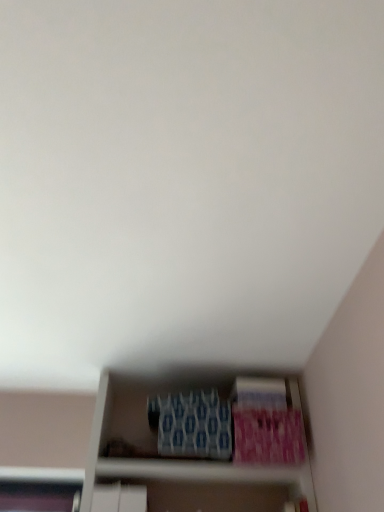
What do you see at coordinates (259, 393) in the screenshot? Image resolution: width=384 pixels, height=512 pixels. I see `blue textured paperback book at lower center, the second paperback book viewed from the left` at bounding box center [259, 393].

How much space does pink matte paperback book at lower right, which appears as the first paperback book when viewed from the right, occupy vertically?

7.54 inches.

This screenshot has width=384, height=512. What do you see at coordinates (268, 436) in the screenshot?
I see `pink matte paperback book at lower right, which is the 3th paperback book in left-to-right order` at bounding box center [268, 436].

You are a GUI agent. You are given a task and a screenshot of the screen. Output one action in this format:
    pyautogui.click(x=<x>, y=<y>)
    Task: Click on the blue textured paperback book at center, the 1th paperback book in the left-to-right sequence
    
    Given the screenshot: What is the action you would take?
    pyautogui.click(x=192, y=424)

Would you consider pink matte paperback book at lower right, which appears as the first paperback book when viewed from the right, to be distant from blue textured paperback book at center, the 3th paperback book in the right-to-left sequence?

No, pink matte paperback book at lower right, which appears as the first paperback book when viewed from the right, is not far away from blue textured paperback book at center, the 3th paperback book in the right-to-left sequence.

Does pink matte paperback book at lower right, which is the 3th paperback book in left-to-right order, come in front of blue textured paperback book at center, the 3th paperback book in the right-to-left sequence?

No, pink matte paperback book at lower right, which is the 3th paperback book in left-to-right order, is further to the viewer.

Which point is more distant from viewer, (303, 438) or (200, 440)?

The point (303, 438) is farther.

Where is `the 1st paperback book above when counting from the pink matte paperback book at lower right, which appears as the first paperback book when viewed from the right (from the image's perspective)`? Image resolution: width=384 pixels, height=512 pixels. the 1st paperback book above when counting from the pink matte paperback book at lower right, which appears as the first paperback book when viewed from the right (from the image's perspective) is located at coordinates (192, 424).

Is blue textured paperback book at center, the 3th paperback book in the right-to-left sequence, next to pink matte paperback book at lower right, which is the 3th paperback book in left-to-right order?

blue textured paperback book at center, the 3th paperback book in the right-to-left sequence, is not next to pink matte paperback book at lower right, which is the 3th paperback book in left-to-right order, and they're not touching.

Which object is thinner, blue textured paperback book at center, the 3th paperback book in the right-to-left sequence, or pink matte paperback book at lower right, which appears as the first paperback book when viewed from the right?

Thinner between the two is pink matte paperback book at lower right, which appears as the first paperback book when viewed from the right.

Does blue textured paperback book at center, the 1th paperback book in the left-to-right sequence, contain pink matte paperback book at lower right, which is the 3th paperback book in left-to-right order?

No, blue textured paperback book at center, the 1th paperback book in the left-to-right sequence, does not contain pink matte paperback book at lower right, which is the 3th paperback book in left-to-right order.

Relative to blue textured paperback book at center, the 1th paperback book in the left-to-right sequence, is blue textured paperback book at lower center, the second paperback book in the right-to-left sequence, in front or behind?

blue textured paperback book at lower center, the second paperback book in the right-to-left sequence, is positioned farther from the viewer than blue textured paperback book at center, the 1th paperback book in the left-to-right sequence.

Based on their sizes in the image, would you say blue textured paperback book at lower center, the second paperback book viewed from the left, is bigger or smaller than blue textured paperback book at center, the 1th paperback book in the left-to-right sequence?

Considering their sizes, blue textured paperback book at lower center, the second paperback book viewed from the left, takes up less space than blue textured paperback book at center, the 1th paperback book in the left-to-right sequence.

Considering the sizes of objects blue textured paperback book at lower center, the second paperback book in the right-to-left sequence, and blue textured paperback book at center, the 3th paperback book in the right-to-left sequence, in the image provided, who is taller, blue textured paperback book at lower center, the second paperback book in the right-to-left sequence, or blue textured paperback book at center, the 3th paperback book in the right-to-left sequence,?

With more height is blue textured paperback book at center, the 3th paperback book in the right-to-left sequence.

Considering the positions of objects blue textured paperback book at center, the 3th paperback book in the right-to-left sequence, and blue textured paperback book at lower center, the second paperback book viewed from the left, in the image provided, who is more to the left, blue textured paperback book at center, the 3th paperback book in the right-to-left sequence, or blue textured paperback book at lower center, the second paperback book viewed from the left,?

From the viewer's perspective, blue textured paperback book at center, the 3th paperback book in the right-to-left sequence, appears more on the left side.

In the scene shown: Is blue textured paperback book at center, the 1th paperback book in the left-to-right sequence, not close to blue textured paperback book at lower center, the second paperback book in the right-to-left sequence?

That's not correct — blue textured paperback book at center, the 1th paperback book in the left-to-right sequence, is a little close to blue textured paperback book at lower center, the second paperback book in the right-to-left sequence.

Is blue textured paperback book at center, the 1th paperback book in the left-to-right sequence, looking in the opposite direction of blue textured paperback book at lower center, the second paperback book in the right-to-left sequence?

No, blue textured paperback book at center, the 1th paperback book in the left-to-right sequence, is not facing the opposite direction of blue textured paperback book at lower center, the second paperback book in the right-to-left sequence.

Considering the positions of objects blue textured paperback book at center, the 3th paperback book in the right-to-left sequence, and blue textured paperback book at lower center, the second paperback book in the right-to-left sequence, in the image provided, who is behind, blue textured paperback book at center, the 3th paperback book in the right-to-left sequence, or blue textured paperback book at lower center, the second paperback book in the right-to-left sequence,?

blue textured paperback book at lower center, the second paperback book in the right-to-left sequence, is further from the camera.

From a real-world perspective, is blue textured paperback book at lower center, the second paperback book in the right-to-left sequence, positioned above or below pink matte paperback book at lower right, which is the 3th paperback book in left-to-right order?

Clearly, from a real-world perspective, blue textured paperback book at lower center, the second paperback book in the right-to-left sequence, is above pink matte paperback book at lower right, which is the 3th paperback book in left-to-right order.

Could you tell me if blue textured paperback book at lower center, the second paperback book in the right-to-left sequence, is facing pink matte paperback book at lower right, which appears as the first paperback book when viewed from the right?

No.

Considering the sizes of objects blue textured paperback book at lower center, the second paperback book viewed from the left, and pink matte paperback book at lower right, which appears as the first paperback book when viewed from the right, in the image provided, who is shorter, blue textured paperback book at lower center, the second paperback book viewed from the left, or pink matte paperback book at lower right, which appears as the first paperback book when viewed from the right,?

blue textured paperback book at lower center, the second paperback book viewed from the left.

From a real-world perspective, who is located lower, pink matte paperback book at lower right, which appears as the first paperback book when viewed from the right, or blue textured paperback book at lower center, the second paperback book in the right-to-left sequence?

In real-world perspective, pink matte paperback book at lower right, which appears as the first paperback book when viewed from the right, is lower.

Based on the photo, is pink matte paperback book at lower right, which is the 3th paperback book in left-to-right order, to the left of blue textured paperback book at lower center, the second paperback book viewed from the left, from the viewer's perspective?

Incorrect, pink matte paperback book at lower right, which is the 3th paperback book in left-to-right order, is not on the left side of blue textured paperback book at lower center, the second paperback book viewed from the left.

Who is shorter, pink matte paperback book at lower right, which appears as the first paperback book when viewed from the right, or blue textured paperback book at lower center, the second paperback book in the right-to-left sequence?

blue textured paperback book at lower center, the second paperback book in the right-to-left sequence, is shorter.

From the image's perspective, is pink matte paperback book at lower right, which is the 3th paperback book in left-to-right order, positioned above or below blue textured paperback book at lower center, the second paperback book in the right-to-left sequence?

Based on their image positions, pink matte paperback book at lower right, which is the 3th paperback book in left-to-right order, is located beneath blue textured paperback book at lower center, the second paperback book in the right-to-left sequence.

Find the location of a particular element. The width and height of the screenshot is (384, 512). paperback book that is the 1st object located behind the blue textured paperback book at center, the 1th paperback book in the left-to-right sequence is located at coordinates (268, 436).

Locate an element on the screen. paperback book that is the 1st object above the pink matte paperback book at lower right, which appears as the first paperback book when viewed from the right (from a real-world perspective) is located at coordinates (192, 424).

From the picture: Based on their spatial positions, is blue textured paperback book at center, the 3th paperback book in the right-to-left sequence, or pink matte paperback book at lower right, which is the 3th paperback book in left-to-right order, further from blue textured paperback book at lower center, the second paperback book in the right-to-left sequence?

Based on the image, blue textured paperback book at center, the 3th paperback book in the right-to-left sequence, appears to be further to blue textured paperback book at lower center, the second paperback book in the right-to-left sequence.

Estimate the real-world distances between objects in this image. Which object is closer to blue textured paperback book at center, the 3th paperback book in the right-to-left sequence, pink matte paperback book at lower right, which is the 3th paperback book in left-to-right order, or blue textured paperback book at lower center, the second paperback book in the right-to-left sequence?

pink matte paperback book at lower right, which is the 3th paperback book in left-to-right order.

Looking at the image, which one is located closer to blue textured paperback book at lower center, the second paperback book viewed from the left, pink matte paperback book at lower right, which appears as the first paperback book when viewed from the right, or blue textured paperback book at center, the 1th paperback book in the left-to-right sequence?

pink matte paperback book at lower right, which appears as the first paperback book when viewed from the right, lies closer to blue textured paperback book at lower center, the second paperback book viewed from the left, than the other object.

Which object lies nearer to the anchor point pink matte paperback book at lower right, which is the 3th paperback book in left-to-right order, blue textured paperback book at lower center, the second paperback book viewed from the left, or blue textured paperback book at center, the 3th paperback book in the right-to-left sequence?

Among the two, blue textured paperback book at lower center, the second paperback book viewed from the left, is located nearer to pink matte paperback book at lower right, which is the 3th paperback book in left-to-right order.

Based on their spatial positions, is blue textured paperback book at lower center, the second paperback book viewed from the left, or pink matte paperback book at lower right, which appears as the first paperback book when viewed from the right, closer to blue textured paperback book at center, the 1th paperback book in the left-to-right sequence?

pink matte paperback book at lower right, which appears as the first paperback book when viewed from the right, is positioned closer to the anchor blue textured paperback book at center, the 1th paperback book in the left-to-right sequence.

Based on their spatial positions, is blue textured paperback book at center, the 1th paperback book in the left-to-right sequence, or blue textured paperback book at lower center, the second paperback book viewed from the left, further from pink matte paperback book at lower right, which is the 3th paperback book in left-to-right order?

Among the two, blue textured paperback book at center, the 1th paperback book in the left-to-right sequence, is located further to pink matte paperback book at lower right, which is the 3th paperback book in left-to-right order.

What are the coordinates of `paperback book between blue textured paperback book at center, the 3th paperback book in the right-to-left sequence, and pink matte paperback book at lower right, which is the 3th paperback book in left-to-right order, from left to right` in the screenshot? It's located at (259, 393).